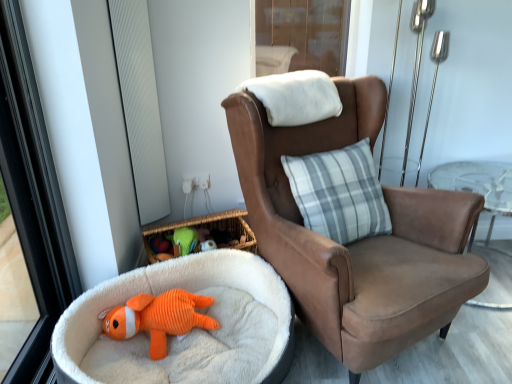
The image size is (512, 384). Identify the location of green corduroy toy at center, acting as the second toy starting from the bottom. (185, 239).

Where is `brown suede chair at center`? The width and height of the screenshot is (512, 384). brown suede chair at center is located at coordinates (357, 241).

You are a GUI agent. You are given a task and a screenshot of the screen. Output one action in this format:
    pyautogui.click(x=<x>, y=<y>)
    Task: Click on the transparent glass screen door at upper center
    Image resolution: width=512 pixels, height=384 pixels.
    Given the screenshot: What is the action you would take?
    pyautogui.click(x=306, y=31)

Considering the relative sizes of green corduroy toy at center, placed as the 1th toy when sorted from back to front, and transparent glass screen door at upper center in the image provided, is green corduroy toy at center, placed as the 1th toy when sorted from back to front, bigger than transparent glass screen door at upper center?

Actually, green corduroy toy at center, placed as the 1th toy when sorted from back to front, might be smaller than transparent glass screen door at upper center.

Consider the image. From a real-world perspective, is green corduroy toy at center, placed as the 2th toy when sorted from front to back, physically located above or below transparent glass screen door at upper center?

green corduroy toy at center, placed as the 2th toy when sorted from front to back, is below transparent glass screen door at upper center.

Is transparent glass screen door at upper center surrounded by green corduroy toy at center, acting as the second toy starting from the bottom?

Actually, transparent glass screen door at upper center is outside green corduroy toy at center, acting as the second toy starting from the bottom.

Does orange corduroy fish at lower left, arranged as the first toy when viewed from the front, come behind transparent glass screen door at upper center?

That is False.

Does orange corduroy fish at lower left, arranged as the first toy when viewed from the front, have a larger size compared to transparent glass screen door at upper center?

Yes, orange corduroy fish at lower left, arranged as the first toy when viewed from the front, is bigger than transparent glass screen door at upper center.

From the image's perspective, between orange corduroy fish at lower left, which ranks as the second toy in back-to-front order, and transparent glass screen door at upper center, which one is located above?

transparent glass screen door at upper center appears higher in the image.

From their relative heights in the image, would you say orange corduroy fish at lower left, arranged as the 1th toy when ordered from the bottom, is taller or shorter than transparent glass screen door at upper center?

In the image, orange corduroy fish at lower left, arranged as the 1th toy when ordered from the bottom, appears to be shorter than transparent glass screen door at upper center.

Could you tell me if transparent glass screen door at upper center is facing white textured window screen at left?

No, transparent glass screen door at upper center is not facing towards white textured window screen at left.

Is transparent glass screen door at upper center not within white textured window screen at left?

That's correct, transparent glass screen door at upper center is outside of white textured window screen at left.

From a real-world perspective, does transparent glass screen door at upper center stand above white textured window screen at left?

Yes, from a real-world perspective, transparent glass screen door at upper center is above white textured window screen at left.

Is transparent glass screen door at upper center to the left of white textured window screen at left from the viewer's perspective?

Incorrect, transparent glass screen door at upper center is not on the left side of white textured window screen at left.

Considering the relative sizes of brown suede chair at center and transparent glass screen door at upper center in the image provided, is brown suede chair at center shorter than transparent glass screen door at upper center?

Incorrect, the height of brown suede chair at center does not fall short of that of transparent glass screen door at upper center.

In terms of width, does brown suede chair at center look wider or thinner when compared to transparent glass screen door at upper center?

Considering their sizes, brown suede chair at center looks broader than transparent glass screen door at upper center.

Is point (464, 296) positioned behind point (337, 53)?

No, (464, 296) is in front of (337, 53).

Could you tell me if brown suede chair at center is facing transparent glass screen door at upper center?

No.

Measure the distance from orange corduroy fish at lower left, which ranks as the second toy in back-to-front order, to green corduroy toy at center, placed as the 1th toy when sorted from back to front.

13.67 inches.

From the image's perspective, is orange corduroy fish at lower left, arranged as the first toy when viewed from the front, above or below green corduroy toy at center, acting as the second toy starting from the bottom?

Clearly, from the image's perspective, orange corduroy fish at lower left, arranged as the first toy when viewed from the front, is below green corduroy toy at center, acting as the second toy starting from the bottom.

Is orange corduroy fish at lower left, arranged as the 1th toy when ordered from the bottom, positioned with its back to green corduroy toy at center, positioned as the first toy in top-to-bottom order?

That's right, orange corduroy fish at lower left, arranged as the 1th toy when ordered from the bottom, is facing away from green corduroy toy at center, positioned as the first toy in top-to-bottom order.

Between brown suede chair at center and orange corduroy fish at lower left, which ranks as the second toy in back-to-front order, which one is positioned behind?

orange corduroy fish at lower left, which ranks as the second toy in back-to-front order, is further away from the camera.

Considering the relative sizes of brown suede chair at center and orange corduroy fish at lower left, which ranks as the second toy in back-to-front order, in the image provided, is brown suede chair at center bigger than orange corduroy fish at lower left, which ranks as the second toy in back-to-front order,?

Yes, brown suede chair at center is bigger than orange corduroy fish at lower left, which ranks as the second toy in back-to-front order.

Can you confirm if brown suede chair at center is shorter than orange corduroy fish at lower left, which ranks as the second toy in back-to-front order?

No.

From the image's perspective, is brown suede chair at center on orange corduroy dog bed at lower left?

Correct, brown suede chair at center appears higher than orange corduroy dog bed at lower left in the image.

The image size is (512, 384). In the image, there is a brown suede chair at center. What are the coordinates of `dog bed below it (from the image's perspective)` in the screenshot? It's located at (189, 291).

Is brown suede chair at center bigger than orange corduroy dog bed at lower left?

Yes.

Image resolution: width=512 pixels, height=384 pixels. In order to click on screen door behind the green corduroy toy at center, positioned as the first toy in top-to-bottom order in this screenshot , I will do `click(306, 31)`.

The image size is (512, 384). What are the coordinates of `screen door above the orange corduroy fish at lower left, arranged as the 1th toy when ordered from the bottom (from the image's perspective)` in the screenshot? It's located at (306, 31).

Consider the image. Considering their positions, is white textured window screen at left positioned closer to brown suede chair at center than orange corduroy dog bed at lower left?

Among the two, orange corduroy dog bed at lower left is located nearer to brown suede chair at center.

When comparing their distances from orange corduroy dog bed at lower left, does orange corduroy fish at lower left, arranged as the first toy when viewed from the front, or green corduroy toy at center, placed as the 1th toy when sorted from back to front, seem further?

green corduroy toy at center, placed as the 1th toy when sorted from back to front, is further to orange corduroy dog bed at lower left.

When comparing their distances from orange corduroy dog bed at lower left, does orange corduroy fish at lower left, arranged as the 1th toy when ordered from the bottom, or transparent glass screen door at upper center seem further?

transparent glass screen door at upper center is further to orange corduroy dog bed at lower left.

Looking at the image, which one is located closer to green corduroy toy at center, placed as the 2th toy when sorted from front to back, brown suede chair at center or white textured window screen at left?

white textured window screen at left lies closer to green corduroy toy at center, placed as the 2th toy when sorted from front to back, than the other object.

From the image, which object appears to be farther from orange corduroy dog bed at lower left, transparent glass screen door at upper center or orange corduroy fish at lower left, marked as the second toy in a top-to-bottom arrangement?

transparent glass screen door at upper center lies further to orange corduroy dog bed at lower left than the other object.

From the image, which object appears to be farther from orange corduroy fish at lower left, arranged as the first toy when viewed from the front, brown suede chair at center or transparent glass screen door at upper center?

Among the two, transparent glass screen door at upper center is located further to orange corduroy fish at lower left, arranged as the first toy when viewed from the front.

Which object lies further to the anchor point orange corduroy fish at lower left, marked as the second toy in a top-to-bottom arrangement, transparent glass screen door at upper center or white textured window screen at left?

transparent glass screen door at upper center is further to orange corduroy fish at lower left, marked as the second toy in a top-to-bottom arrangement.

Estimate the real-world distances between objects in this image. Which object is closer to transparent glass screen door at upper center, brown suede chair at center or orange corduroy dog bed at lower left?

brown suede chair at center is closer to transparent glass screen door at upper center.

The height and width of the screenshot is (384, 512). Find the location of `window screen between transparent glass screen door at upper center and green corduroy toy at center, placed as the 1th toy when sorted from back to front, in the up-down direction`. window screen between transparent glass screen door at upper center and green corduroy toy at center, placed as the 1th toy when sorted from back to front, in the up-down direction is located at coordinates (140, 105).

The width and height of the screenshot is (512, 384). Identify the location of window screen between orange corduroy dog bed at lower left and green corduroy toy at center, acting as the second toy starting from the bottom, from front to back. (140, 105).

At what (x,y) coordinates should I click in order to perform the action: click on dog bed between white textured window screen at left and brown suede chair at center from left to right. Please return your answer as a coordinate pair (x, y). Looking at the image, I should click on (189, 291).

Locate an element on the screen. chair between transparent glass screen door at upper center and orange corduroy fish at lower left, arranged as the first toy when viewed from the front, from top to bottom is located at coordinates (357, 241).